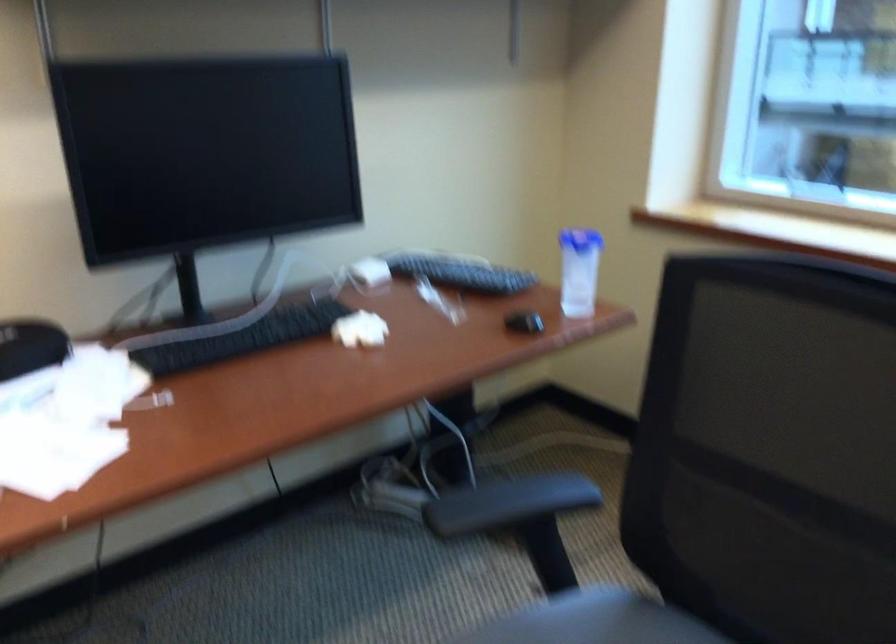
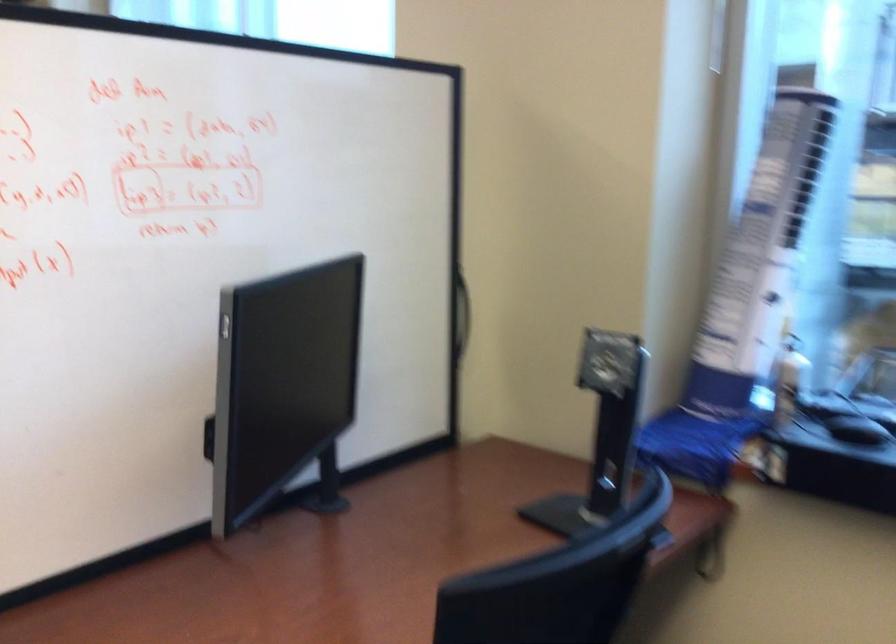
What movement of the cameraman would produce the second image?

The movement direction of the cameraman is right, backward.